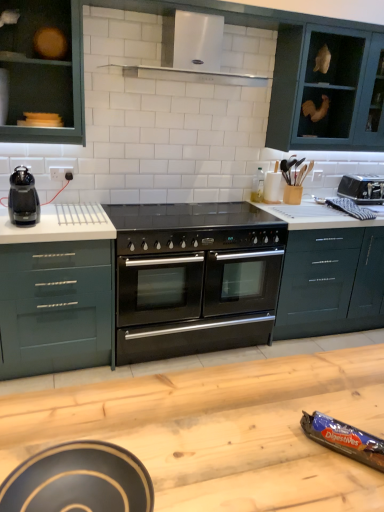
Locate an element on the screen. Image resolution: width=384 pixels, height=512 pixels. free point above wooden at center (from a real-world perspective) is located at coordinates (228, 426).